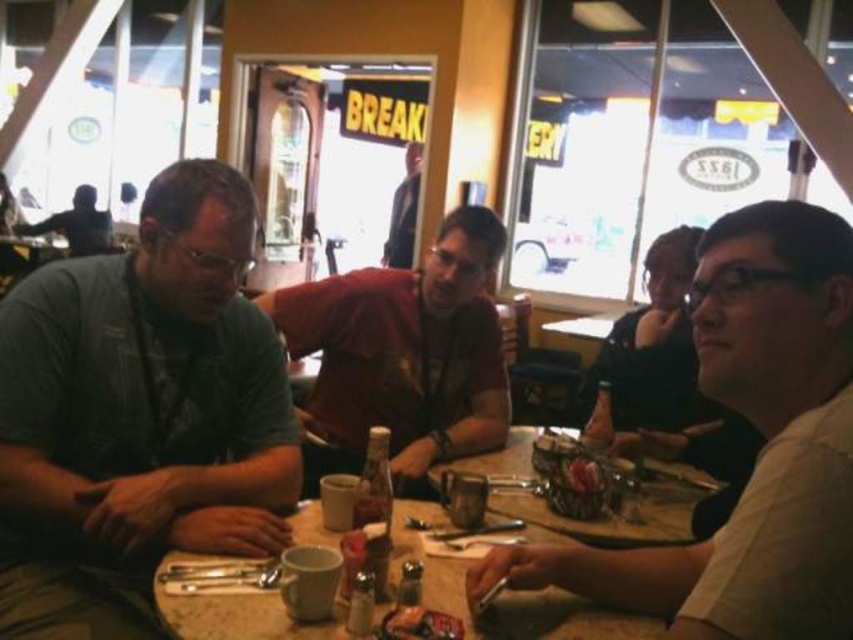
Is point (331, 317) farther from camera compared to point (79, 253)?

No, it is not.

Identify the location of matte red shirt at center. (404, 353).

Who is more forward, (428, 291) or (102, 250)?

Positioned in front is point (428, 291).

Find the location of a particular element. The width and height of the screenshot is (853, 640). matte red shirt at center is located at coordinates (404, 353).

Is matte black shirt at upper left thinner than shiny plastic fork at lower center?

No.

Between matte black shirt at upper left and shiny plastic fork at lower center, which one has more height?

With more height is matte black shirt at upper left.

Describe the element at coordinates (76, 225) in the screenshot. I see `matte black shirt at upper left` at that location.

Find the location of `matte black shirt at upper left`. matte black shirt at upper left is located at coordinates [x=76, y=225].

Between gray cotton shirt at left and matte red shirt at center, which one appears on the right side from the viewer's perspective?

From the viewer's perspective, matte red shirt at center appears more on the right side.

Between gray cotton shirt at left and matte red shirt at center, which one is positioned lower?

gray cotton shirt at left is below.

Identify the location of gray cotton shirt at left. (138, 416).